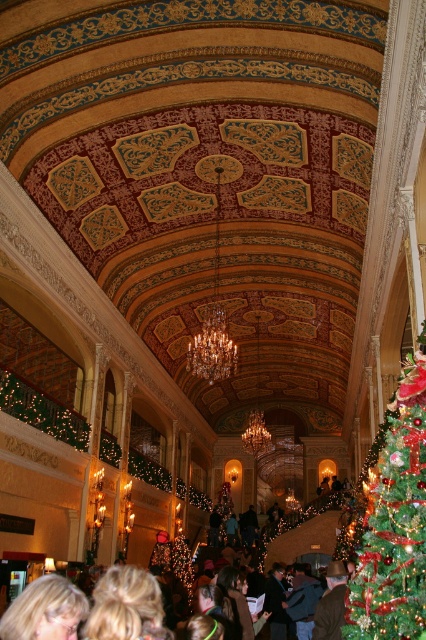
The height and width of the screenshot is (640, 426). What do you see at coordinates (394, 518) in the screenshot? I see `green shiny christmas tree at center` at bounding box center [394, 518].

Who is more distant from viewer, (x=377, y=582) or (x=337, y=570)?

Point (x=337, y=570)

Who is more forward, (x=348, y=616) or (x=333, y=579)?

Point (x=348, y=616) is in front.

Locate an element on the screen. The height and width of the screenshot is (640, 426). green shiny christmas tree at center is located at coordinates (394, 518).

Find the location of `blonde hair at lower left`. blonde hair at lower left is located at coordinates (319, 602).

Who is positioned more to the left, blonde hair at lower left or brown leather jacket at center?

From the viewer's perspective, blonde hair at lower left appears more on the left side.

Which is in front, point (301, 577) or point (345, 588)?

Point (345, 588)

Locate an element on the screen. The image size is (426, 640). blonde hair at lower left is located at coordinates (319, 602).

Is green shiny christmas tree at center to the left of blonde hair at lower left from the viewer's perspective?

Incorrect, green shiny christmas tree at center is not on the left side of blonde hair at lower left.

Is green shiny christmas tree at center to the right of blonde hair at lower left from the viewer's perspective?

Indeed, green shiny christmas tree at center is positioned on the right side of blonde hair at lower left.

Is point (379, 506) more distant than point (337, 605)?

That is False.

The image size is (426, 640). I want to click on green shiny christmas tree at center, so click(394, 518).